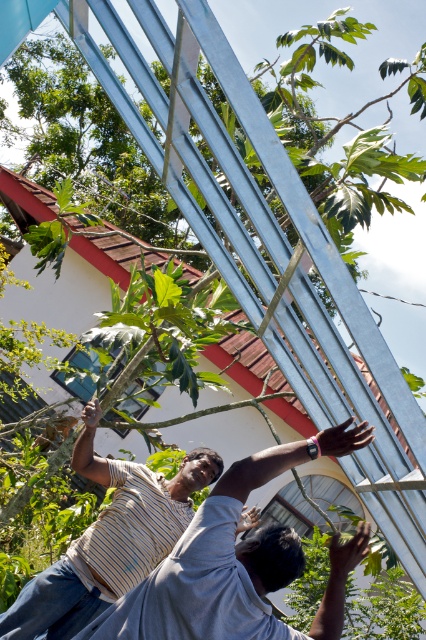
Can you confirm if striped cotton shirt at center is taller than striped fabric at lower center?

No.

Can you confirm if striped cotton shirt at center is positioned to the left of striped fabric at lower center?

Incorrect, striped cotton shirt at center is not on the left side of striped fabric at lower center.

Between point (298, 552) and point (63, 593), which one is positioned in front?

Point (298, 552) is more forward.

At what (x,y) coordinates should I click in order to perform the action: click on striped cotton shirt at center. Please return your answer as a coordinate pair (x, y). The image size is (426, 640). Looking at the image, I should click on pos(230,572).